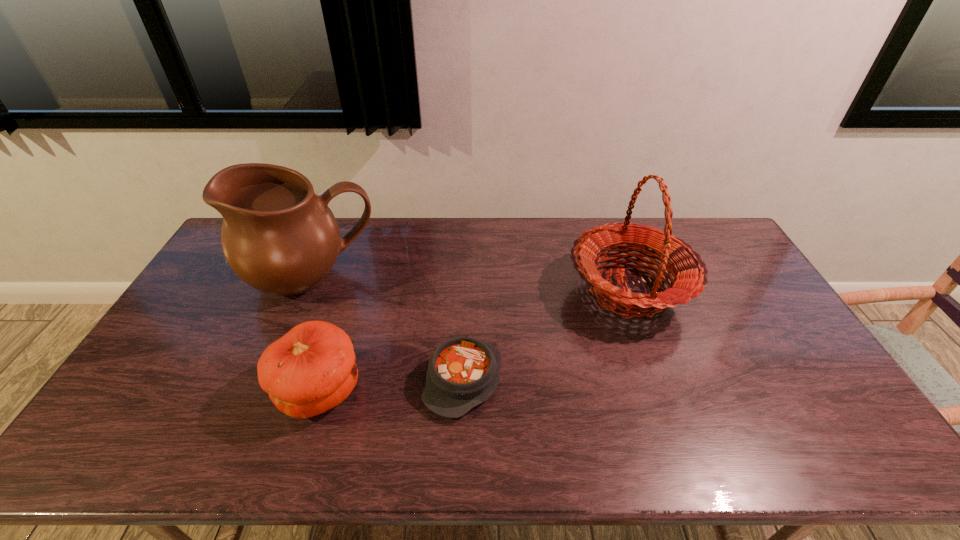
Identify the location of vacant area that lies between the basket and the shortest object. (545, 336).

This screenshot has height=540, width=960. I want to click on free area in between the third tallest object and the casserole, so click(392, 386).

Locate an element on the screen. free spot between the cream pitcher and the rightmost object is located at coordinates (470, 285).

The height and width of the screenshot is (540, 960). I want to click on vacant space in between the third tallest object and the third object from left to right, so click(392, 386).

The width and height of the screenshot is (960, 540). I want to click on empty space that is in between the third object from left to right and the rightmost object, so click(x=545, y=336).

The width and height of the screenshot is (960, 540). What are the coordinates of `object that is the closest one to the second shortest object` in the screenshot? It's located at tap(463, 372).

I want to click on the third closest object to the pumpkin, so click(x=689, y=272).

Where is `vacant space that satisfies the following two spatial constraints: 1. on the back side of the shortest object; 2. on the left side of the second shortest object`? The height and width of the screenshot is (540, 960). vacant space that satisfies the following two spatial constraints: 1. on the back side of the shortest object; 2. on the left side of the second shortest object is located at coordinates (324, 380).

Identify the location of vacant space that satisfies the following two spatial constraints: 1. at the spout of the third tallest object; 2. on the right side of the cream pitcher. The image size is (960, 540). (265, 392).

Identify the location of blank space that satisfies the following two spatial constraints: 1. at the spout of the cream pitcher; 2. on the left side of the basket. (306, 292).